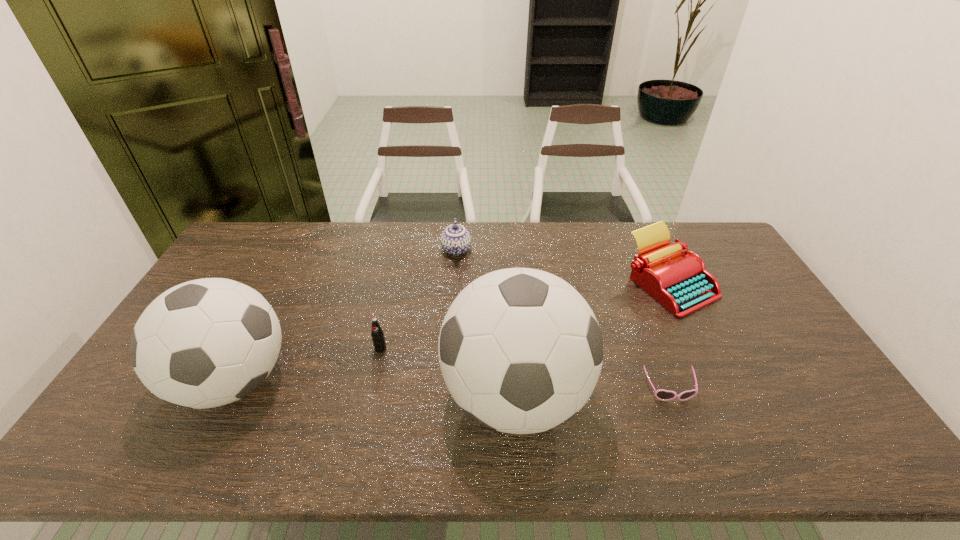
Identify the location of vacant space at the far edge of the desktop. The width and height of the screenshot is (960, 540). (571, 245).

Identify the location of vacant space at the near edge of the desktop. (593, 402).

In the image, there is a desktop. Identify the location of blank space at the right edge. The height and width of the screenshot is (540, 960). (713, 269).

Locate an element on the screen. The width and height of the screenshot is (960, 540). blank area at the far left corner is located at coordinates (261, 222).

Locate an element on the screen. This screenshot has height=540, width=960. free spot between the left soccer ball and the chinaware is located at coordinates point(345,315).

The height and width of the screenshot is (540, 960). I want to click on free space between the chinaware and the pop, so click(419, 299).

What are the coordinates of `free point between the fourth shortest object and the sunglasses` in the screenshot? It's located at (669, 336).

Identify which object is the fourth closest to the chinaware. Please provide its 2D coordinates. Your answer should be formatted as a tuple, i.e. [(x, y)], where the tuple contains the x and y coordinates of a point satisfying the conditions above.

[(680, 282)]

Locate which object is the closest to the chinaware. Please provide its 2D coordinates. Your answer should be formatted as a tuple, i.e. [(x, y)], where the tuple contains the x and y coordinates of a point satisfying the conditions above.

[(520, 350)]